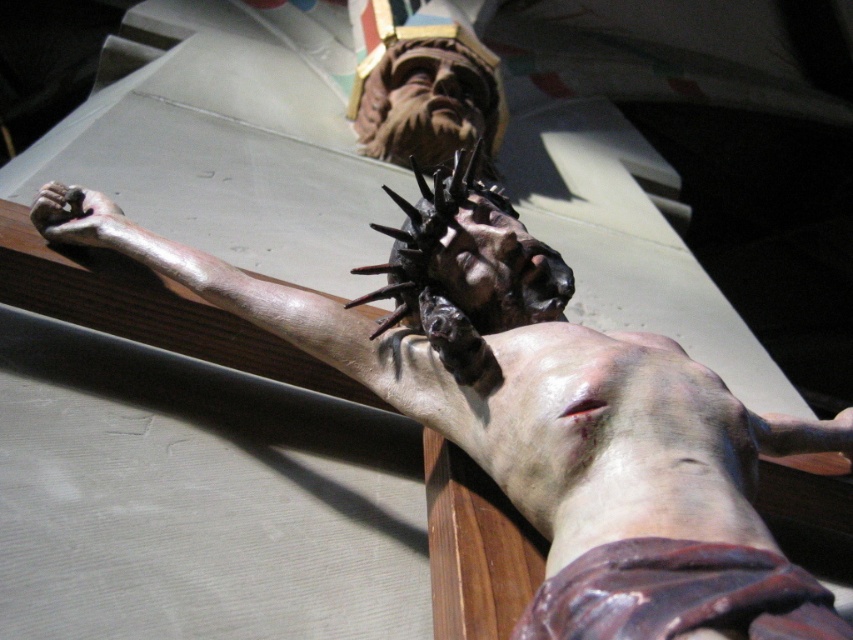
Question: Does matte brown statue at center appear over matte brown hand at lower left?

Choices:
 (A) no
 (B) yes

Answer: (A)

Question: Can you confirm if matte brown statue at center is positioned above matte brown hand at lower left?

Choices:
 (A) yes
 (B) no

Answer: (B)

Question: Which of the following is the closest to the observer?

Choices:
 (A) matte brown hand at lower left
 (B) matte brown statue at center

Answer: (B)

Question: Does matte brown statue at center have a lesser width compared to matte brown hand at lower left?

Choices:
 (A) yes
 (B) no

Answer: (B)

Question: Among these objects, which one is nearest to the camera?

Choices:
 (A) matte brown hand at lower left
 (B) matte brown statue at center

Answer: (B)

Question: Among these points, which one is farthest from the camera?

Choices:
 (A) (720, 550)
 (B) (48, 211)

Answer: (B)